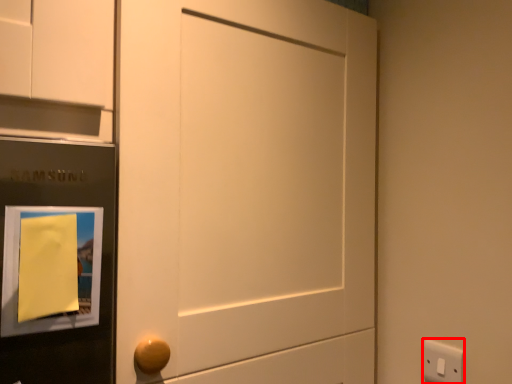
Question: From the image's perspective, considering the relative positions of light switch (annotated by the red box) and picture frame in the image provided, where is light switch (annotated by the red box) located with respect to the staircase?

Choices:
 (A) above
 (B) below

Answer: (B)